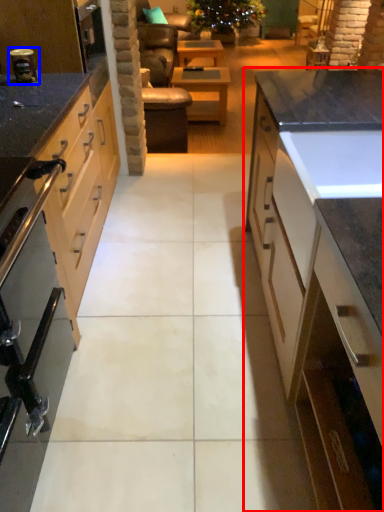
Question: Which object appears closest to the camera in this image, cabinetry (highlighted by a red box) or appliance (highlighted by a blue box)?

Choices:
 (A) cabinetry
 (B) appliance

Answer: (A)